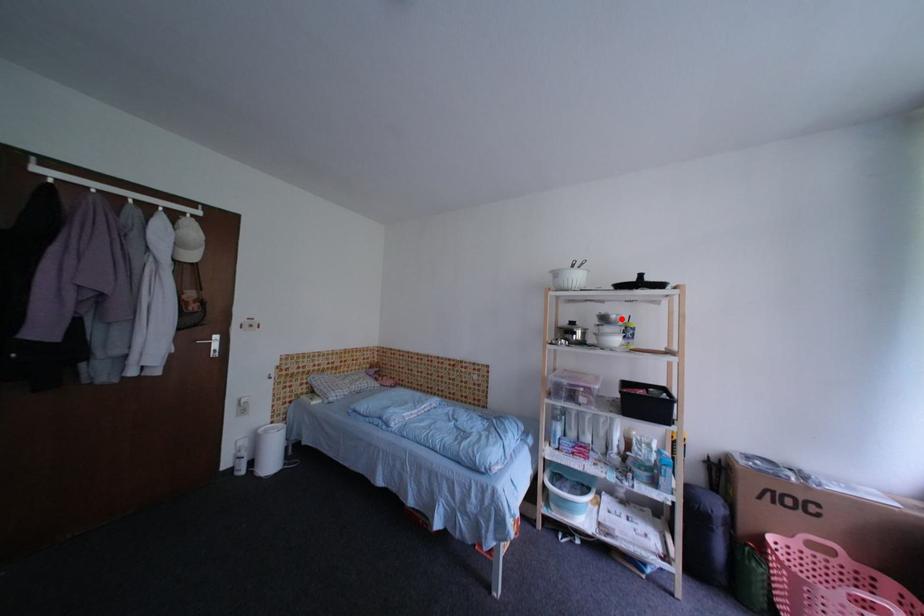
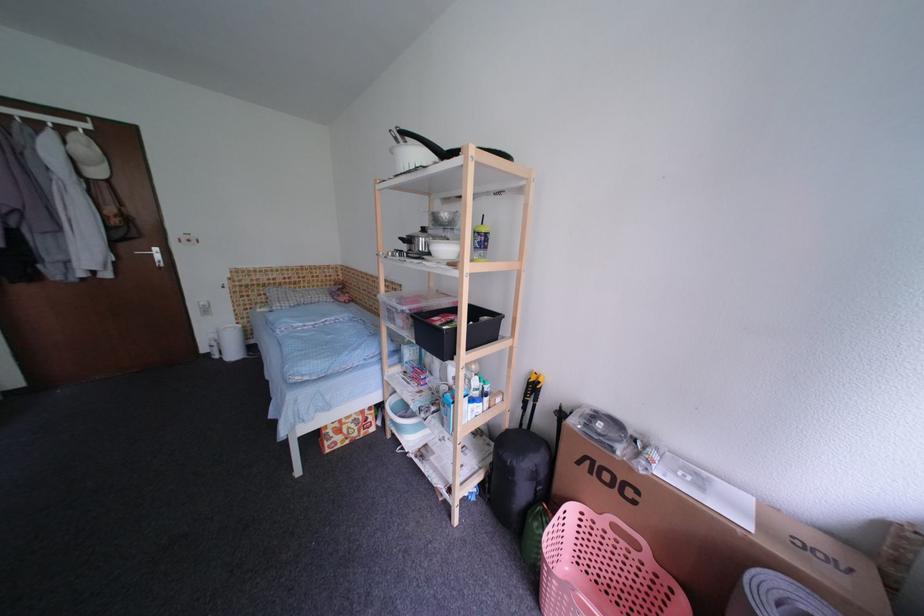
The point at the highlighted location is marked in the first image. Where is the corresponding point in the second image?

(453, 217)